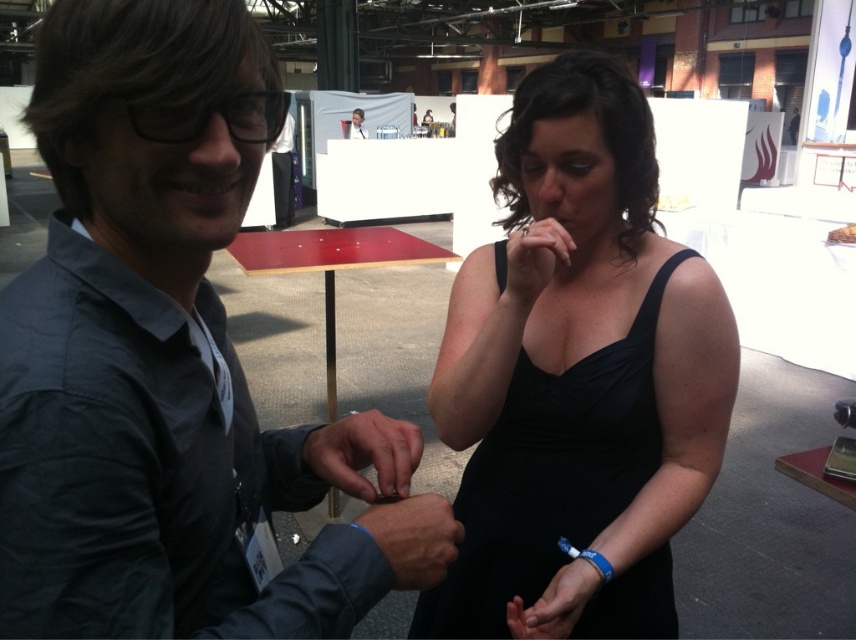
You are at an indoor event and want to take a photo of the woman in the black sleeveless dress. There is a matte black hand at center located at point [364,452]. Will this hand block your view of the woman?

The matte black hand at center is located at point [364,452], which is at the center of the image. Since the woman in the black sleeveless dress is on the right, the hand might block part of her view depending on the camera angle and distance.

You are an event photographer at the exhibition. You need to capture a photo of the matte gray shirt at center and the matte black hand at center. Which object should you focus on first to ensure both are in frame?

The matte gray shirt at center is much taller than the matte black hand at center, so you should focus on the matte gray shirt at center first to ensure both are in frame.